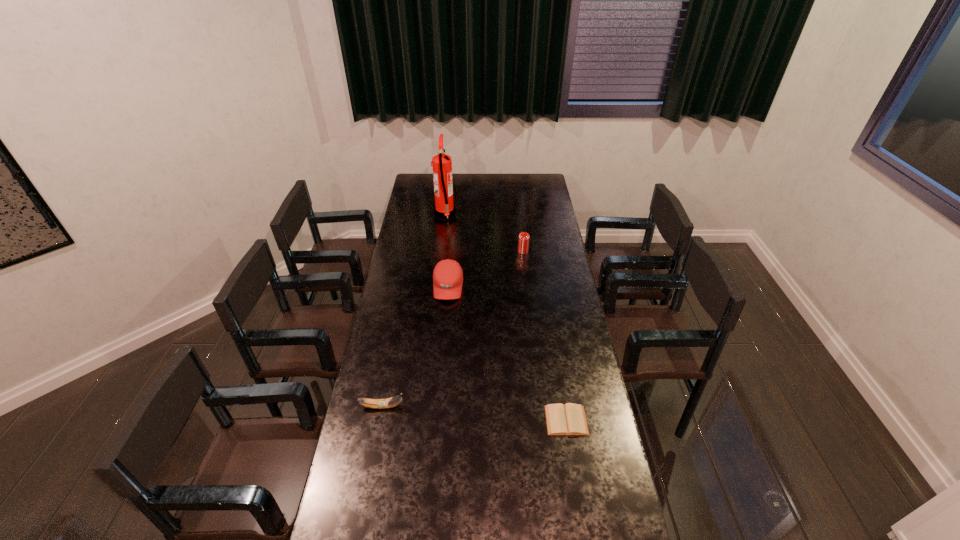
The height and width of the screenshot is (540, 960). What are the coordinates of `vacant space that satisfies the following two spatial constraints: 1. on the back side of the second farthest object; 2. with the nozzle aimed from the tallest object` in the screenshot? It's located at (518, 215).